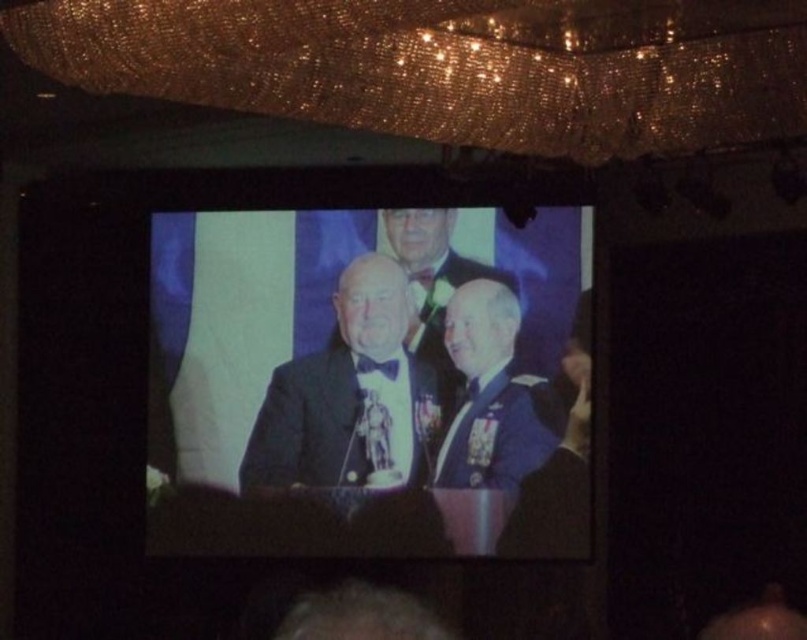
From the picture: You are a photographer at the event and need to capture a clear photo of both the black satin suit at center and the shiny blue suit at center. Since the lighting is dim, you decide to use a flash. However, the flash might cause glare on the shiny surfaces. Which suit is more likely to reflect the flash and create glare?

The shiny blue suit at center is more likely to reflect the flash and create glare because its surface is shinier compared to the black satin suit at center.

You are an event planner arranging a photo display. The image includes a point marked at coordinates [375,387]. What object is located at that point?

The point at coordinates [375,387] marks the black satin suit at center.

You are standing in front of the projection screen showing the photograph of three men. You notice a specific point marked at coordinates (350, 396). What object is located exactly at that point on the screen?

The object located exactly at the point (350, 396) on the screen is the satin black suit at center.